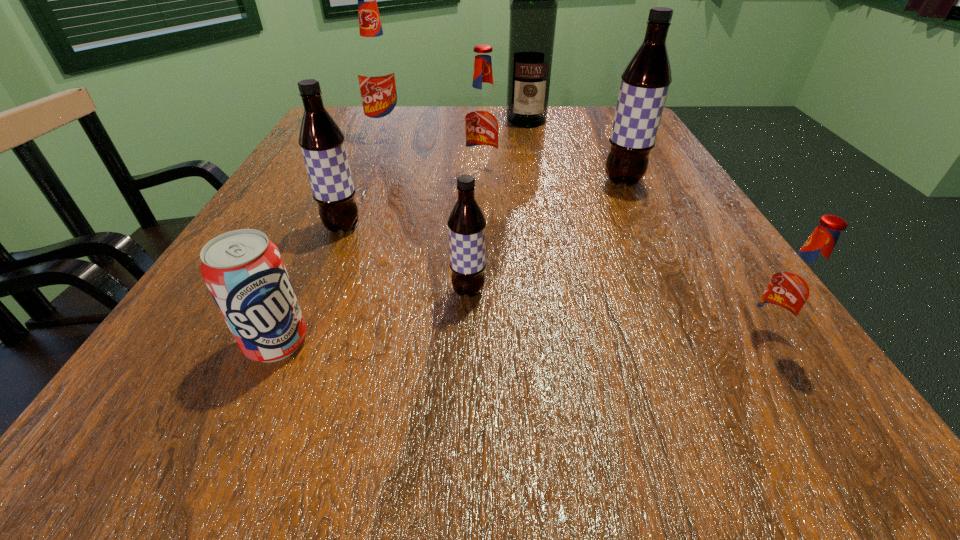
The width and height of the screenshot is (960, 540). Identify the location of the third closest object to the fourth farthest root beer. (482, 119).

Locate an element on the screen. This screenshot has width=960, height=540. object that is the third closest to the farthest object is located at coordinates (376, 70).

Identify the location of root beer object that ranks as the fifth closest to the second red root beer from right to left. This screenshot has height=540, width=960. (793, 289).

Identify which root beer is located as the second nearest to the nearest red root beer. Please provide its 2D coordinates. Your answer should be formatted as a tuple, i.e. [(x, y)], where the tuple contains the x and y coordinates of a point satisfying the conditions above.

[(645, 82)]

Locate an element on the screen. This screenshot has width=960, height=540. red root beer that stands as the second closest to the tallest object is located at coordinates (376, 70).

The height and width of the screenshot is (540, 960). I want to click on red root beer that is the third closest to the farthest brown root beer, so click(x=376, y=70).

What are the coordinates of `brown root beer that stands as the second closest to the rightmost brown root beer` in the screenshot? It's located at (322, 143).

Where is `brown root beer that is the nearest to the sixth farthest object`? Image resolution: width=960 pixels, height=540 pixels. brown root beer that is the nearest to the sixth farthest object is located at coordinates (322, 143).

Where is `vacant space that satisfies the following two spatial constraints: 1. on the front side of the second brown root beer from left to right; 2. on the right side of the third nearest root beer`? This screenshot has width=960, height=540. vacant space that satisfies the following two spatial constraints: 1. on the front side of the second brown root beer from left to right; 2. on the right side of the third nearest root beer is located at coordinates (316, 291).

Locate an element on the screen. vacant space that satisfies the following two spatial constraints: 1. on the front and back of the farthest object; 2. on the right side of the second root beer from right to left is located at coordinates (539, 181).